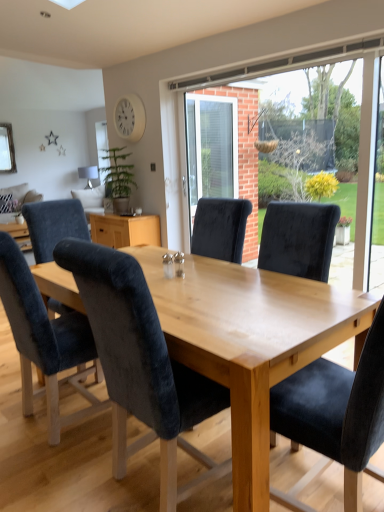
Question: Is velvet black chair at center, arranged as the 4th chair when viewed from the left, thinner than white matte clock at upper center?

Choices:
 (A) no
 (B) yes

Answer: (A)

Question: Does velvet black chair at center, the fourth chair positioned from the back, appear on the right side of white matte clock at upper center?

Choices:
 (A) no
 (B) yes

Answer: (B)

Question: Would you consider velvet black chair at center, arranged as the 4th chair when viewed from the left, to be distant from white matte clock at upper center?

Choices:
 (A) no
 (B) yes

Answer: (B)

Question: Is velvet black chair at center, arranged as the 4th chair when viewed from the left, not inside white matte clock at upper center?

Choices:
 (A) no
 (B) yes

Answer: (B)

Question: Is velvet black chair at center, placed as the first chair when sorted from front to back, positioned before white matte clock at upper center?

Choices:
 (A) yes
 (B) no

Answer: (A)

Question: Considering the relative positions of velvet dark blue chair at center, the third chair when ordered from left to right, and velvet dark blue chair at lower left, the 2th chair in the back-to-front sequence, in the image provided, is velvet dark blue chair at center, the third chair when ordered from left to right, to the left or to the right of velvet dark blue chair at lower left, the 2th chair in the back-to-front sequence,?

Choices:
 (A) right
 (B) left

Answer: (A)

Question: Is velvet dark blue chair at center, which is counted as the 2th chair, starting from the front, in front of or behind velvet dark blue chair at lower left, the 2th chair in the back-to-front sequence, in the image?

Choices:
 (A) front
 (B) behind

Answer: (A)

Question: Is point (120, 285) positioned closer to the camera than point (56, 390)?

Choices:
 (A) farther
 (B) closer

Answer: (B)

Question: In terms of width, does velvet dark blue chair at center, which is counted as the 2th chair, starting from the front, look wider or thinner when compared to velvet dark blue chair at lower left, positioned as the second chair in left-to-right order?

Choices:
 (A) wide
 (B) thin

Answer: (A)

Question: Considering the relative positions of transparent glass window at center and velvet blue chair at center, arranged as the first chair when viewed from the left, in the image provided, is transparent glass window at center to the left or to the right of velvet blue chair at center, arranged as the first chair when viewed from the left,?

Choices:
 (A) left
 (B) right

Answer: (B)

Question: Is transparent glass window at center inside or outside of velvet blue chair at center, which is the 4th chair from right to left?

Choices:
 (A) inside
 (B) outside

Answer: (B)

Question: From their relative heights in the image, would you say transparent glass window at center is taller or shorter than velvet blue chair at center, which is the 4th chair from right to left?

Choices:
 (A) tall
 (B) short

Answer: (A)

Question: Does point click(x=317, y=166) appear closer or farther from the camera than point click(x=94, y=206)?

Choices:
 (A) closer
 (B) farther

Answer: (A)

Question: Considering their positions, is matte silver lamp at upper left located in front of or behind velvet black chair at center, placed as the first chair when sorted from front to back?

Choices:
 (A) behind
 (B) front

Answer: (A)

Question: Is point (87, 181) positioned closer to the camera than point (362, 352)?

Choices:
 (A) closer
 (B) farther

Answer: (B)